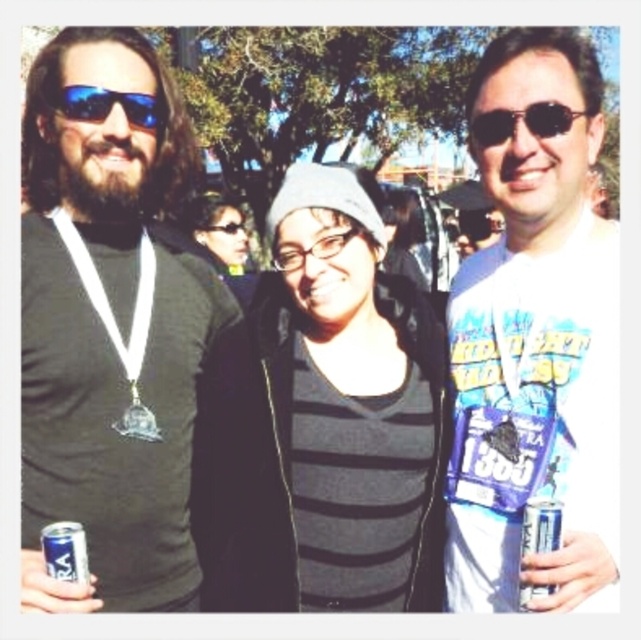
Question: Which object is closer to the camera taking this photo?

Choices:
 (A) matte black shirt at left
 (B) blue reflective sunglasses at left

Answer: (A)

Question: Which object appears farthest from the camera in this image?

Choices:
 (A) blue aluminum can at lower left
 (B) striped fabric shirt at center
 (C) white glossy t-shirt at center

Answer: (B)

Question: Does matte black shirt at left have a larger size compared to striped fabric shirt at center?

Choices:
 (A) no
 (B) yes

Answer: (B)

Question: Does white glossy t-shirt at center appear on the left side of striped fabric shirt at center?

Choices:
 (A) no
 (B) yes

Answer: (A)

Question: Does striped fabric shirt at center have a larger size compared to blue aluminum can at lower left?

Choices:
 (A) yes
 (B) no

Answer: (A)

Question: Which object is the farthest from the blue reflective sunglasses at left?

Choices:
 (A) transparent plastic goggles at center
 (B) blue aluminum can at lower left
 (C) silver metallic medal at center

Answer: (A)